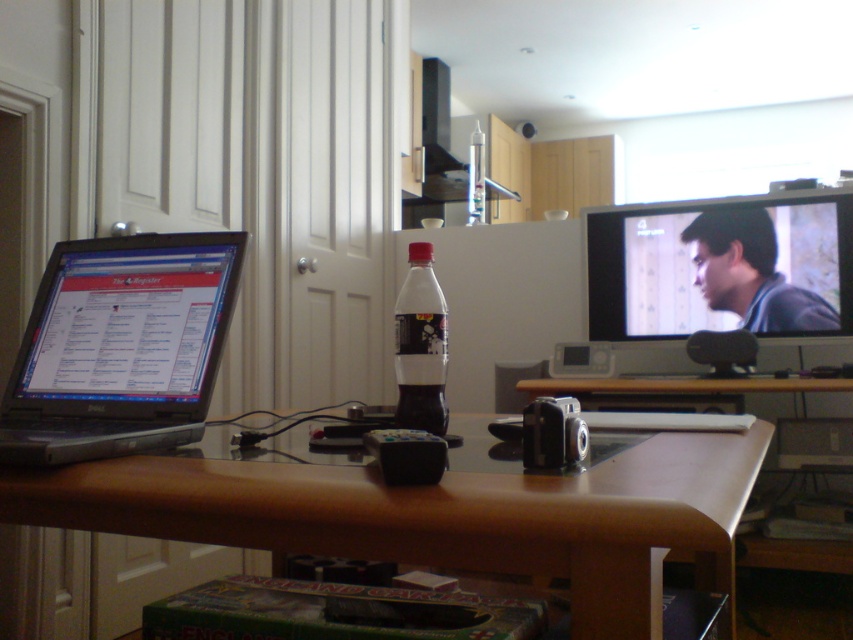
Who is more forward, (30,362) or (643,310)?

Point (30,362) is in front.

Image resolution: width=853 pixels, height=640 pixels. I want to click on matte black laptop at left, so click(x=120, y=346).

Locate an element on the screen. matte black laptop at left is located at coordinates (120, 346).

Does brown wood table at center have a lesser width compared to matte black laptop at left?

No.

Image resolution: width=853 pixels, height=640 pixels. What do you see at coordinates (442, 513) in the screenshot? I see `brown wood table at center` at bounding box center [442, 513].

Who is more distant from viewer, (x=473, y=564) or (x=62, y=419)?

Point (x=62, y=419)

Identify the location of brown wood table at center. point(442,513).

Describe the element at coordinates (442, 513) in the screenshot. I see `brown wood table at center` at that location.

Is brown wood table at center to the left of matte black monitor at right from the viewer's perspective?

Yes, brown wood table at center is to the left of matte black monitor at right.

Locate an element on the screen. The width and height of the screenshot is (853, 640). brown wood table at center is located at coordinates (442, 513).

This screenshot has height=640, width=853. In order to click on brown wood table at center in this screenshot , I will do `click(442, 513)`.